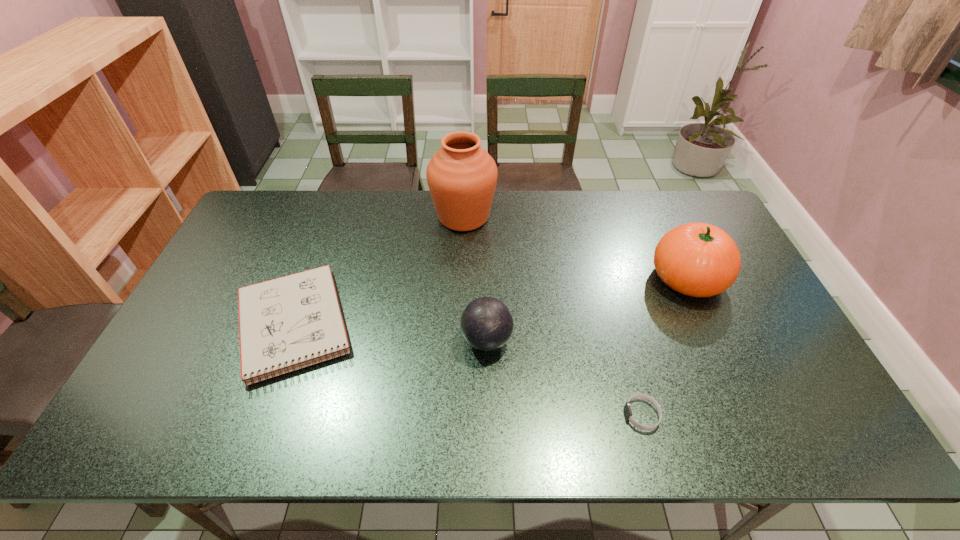
At what (x,y) coordinates should I click in order to perform the action: click on object that is at the left edge. Please return your answer as a coordinate pair (x, y). The width and height of the screenshot is (960, 540). Looking at the image, I should click on (294, 321).

The height and width of the screenshot is (540, 960). I want to click on object at the right edge, so click(x=696, y=259).

Where is `blank space at the far edge of the desktop`? blank space at the far edge of the desktop is located at coordinates (384, 193).

The width and height of the screenshot is (960, 540). Identify the location of free location at the left edge. (210, 283).

Identify the location of vacant region at the far left corner of the desktop. Image resolution: width=960 pixels, height=540 pixels. (258, 211).

I want to click on free space between the bowling ball and the second shortest object, so click(390, 333).

The image size is (960, 540). What are the coordinates of `unoccupied position between the third tallest object and the pumpkin` in the screenshot? It's located at (588, 309).

The height and width of the screenshot is (540, 960). Find the location of `free spot between the third tallest object and the farthest object`. free spot between the third tallest object and the farthest object is located at coordinates (475, 278).

Identify the location of vacant area that lies between the nearest object and the third tallest object. The image size is (960, 540). (564, 377).

Locate an element on the screen. This screenshot has width=960, height=540. free space between the bowling ball and the urn is located at coordinates (475, 278).